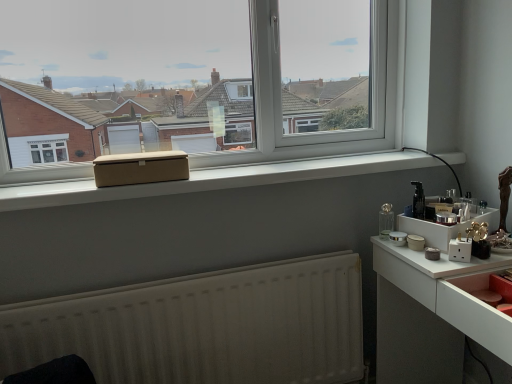
Question: Is beige fabric box at center positioned behind matte pink drawer at lower right?

Choices:
 (A) yes
 (B) no

Answer: (A)

Question: From a real-world perspective, is beige fabric box at center over matte pink drawer at lower right?

Choices:
 (A) yes
 (B) no

Answer: (A)

Question: Does beige fabric box at center have a lesser width compared to matte pink drawer at lower right?

Choices:
 (A) yes
 (B) no

Answer: (A)

Question: Considering the relative sizes of beige fabric box at center and matte pink drawer at lower right in the image provided, is beige fabric box at center taller than matte pink drawer at lower right?

Choices:
 (A) no
 (B) yes

Answer: (B)

Question: Is beige fabric box at center not inside matte pink drawer at lower right?

Choices:
 (A) yes
 (B) no

Answer: (A)

Question: Looking at their shapes, would you say white glossy counter at right is wider or thinner than beige fabric box at center?

Choices:
 (A) wide
 (B) thin

Answer: (A)

Question: From a real-world perspective, relative to beige fabric box at center, is white glossy counter at right vertically above or below?

Choices:
 (A) above
 (B) below

Answer: (B)

Question: Considering the relative positions of white glossy counter at right and beige fabric box at center in the image provided, is white glossy counter at right to the left or to the right of beige fabric box at center?

Choices:
 (A) right
 (B) left

Answer: (A)

Question: In the image, is white glossy counter at right positioned in front of or behind beige fabric box at center?

Choices:
 (A) front
 (B) behind

Answer: (A)

Question: Which is correct: beige fabric box at center is inside white glossy counter at right, or outside of it?

Choices:
 (A) inside
 (B) outside

Answer: (B)

Question: Is beige fabric box at center in front of or behind white glossy counter at right in the image?

Choices:
 (A) behind
 (B) front

Answer: (A)

Question: Is beige fabric box at center taller or shorter than white glossy counter at right?

Choices:
 (A) short
 (B) tall

Answer: (A)

Question: Considering the positions of beige fabric box at center and white glossy counter at right in the image, is beige fabric box at center bigger or smaller than white glossy counter at right?

Choices:
 (A) big
 (B) small

Answer: (B)

Question: In terms of width, does white matte radiator at lower center look wider or thinner when compared to white glossy counter at right?

Choices:
 (A) thin
 (B) wide

Answer: (A)

Question: Is point (352, 332) positioned closer to the camera than point (424, 271)?

Choices:
 (A) farther
 (B) closer

Answer: (A)